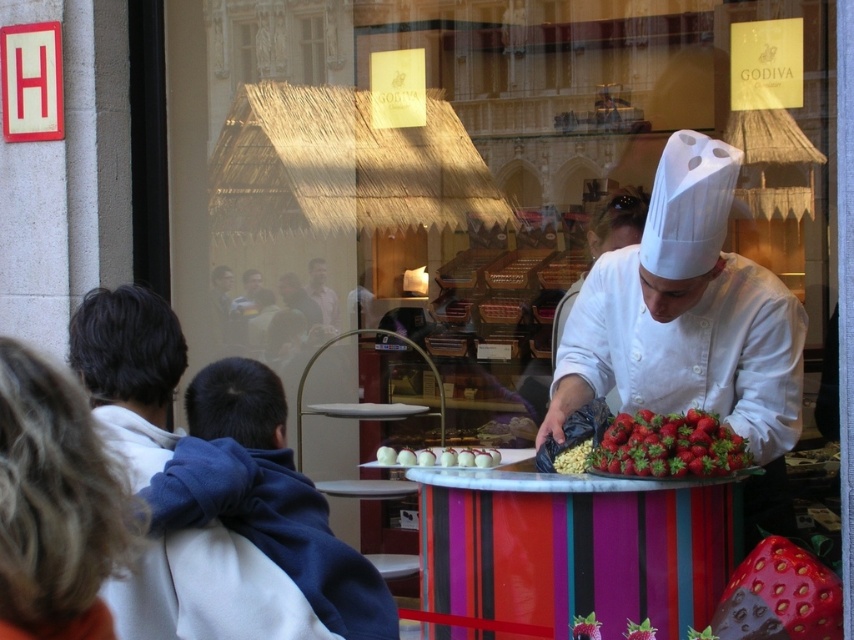
You are a customer in the Godiva chocolate shop and see both the red matte strawberries at center and the smooth skin face at center on the table. Which object is located to the right of the other?

The red matte strawberries at center is positioned on the right side of smooth skin face at center.

You are a customer standing at the entrance of the Godiva chocolate shop. You see a red matte strawberries at center and a smooth skin face at center on the table. If you want to reach both items, which one would you need to walk closer to first?

The red matte strawberries at center and smooth skin face at center are 11.38 feet apart. Since you are at the entrance, you would need to walk closer to both items first to reach them, but the question doesn not specify their distance from you, only from each other.